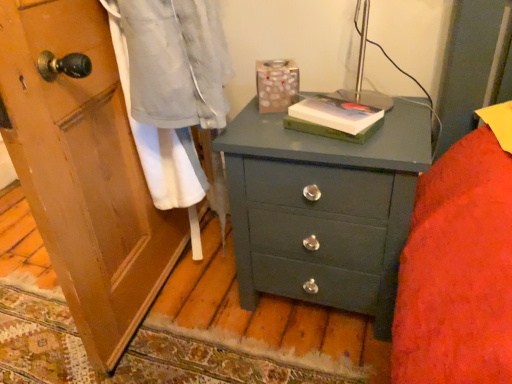
The height and width of the screenshot is (384, 512). Identify the location of vacant area that is situated to the right of hardcover book at center, marked as the 1th book in a bottom-to-top arrangement. (403, 119).